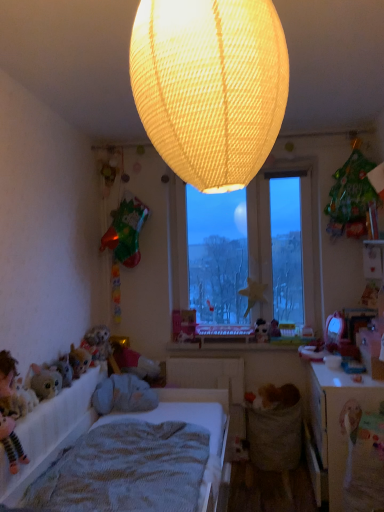
Question: Does white fabric bed at lower left have a smaller size compared to wooden table at lower right?

Choices:
 (A) no
 (B) yes

Answer: (A)

Question: Can we say white fabric bed at lower left lies outside wooden table at lower right?

Choices:
 (A) yes
 (B) no

Answer: (A)

Question: Is white fabric bed at lower left wider than wooden table at lower right?

Choices:
 (A) no
 (B) yes

Answer: (B)

Question: Does white fabric bed at lower left have a lesser width compared to wooden table at lower right?

Choices:
 (A) yes
 (B) no

Answer: (B)

Question: Is white fabric bed at lower left bigger than wooden table at lower right?

Choices:
 (A) yes
 (B) no

Answer: (A)

Question: From a real-world perspective, is green matte bag at upper right, which is counted as the first toy, starting from the front, physically located above or below gray plush toy at lower left?

Choices:
 (A) below
 (B) above

Answer: (B)

Question: In terms of height, does green matte bag at upper right, the first toy in the top-to-bottom sequence, look taller or shorter compared to gray plush toy at lower left?

Choices:
 (A) short
 (B) tall

Answer: (B)

Question: Is green matte bag at upper right, the 2th toy when ordered from back to front, situated inside gray plush toy at lower left or outside?

Choices:
 (A) outside
 (B) inside

Answer: (A)

Question: In the image, is green matte bag at upper right, the first toy in the top-to-bottom sequence, on the left side or the right side of gray plush toy at lower left?

Choices:
 (A) left
 (B) right

Answer: (B)

Question: Based on their sizes in the image, would you say fluffy plush toy at lower left is bigger or smaller than matte plastic toy at center, marked as the first toy in a left-to-right arrangement?

Choices:
 (A) small
 (B) big

Answer: (B)

Question: Choose the correct answer: Is fluffy plush toy at lower left inside matte plastic toy at center, arranged as the second toy when viewed from the right, or outside it?

Choices:
 (A) inside
 (B) outside

Answer: (B)

Question: From the image's perspective, is fluffy plush toy at lower left above or below matte plastic toy at center, arranged as the first toy when viewed from the back?

Choices:
 (A) below
 (B) above

Answer: (A)

Question: Does point (1, 385) appear closer or farther from the camera than point (261, 338)?

Choices:
 (A) closer
 (B) farther

Answer: (A)

Question: Is matte yellow fabric lampshade at upper center taller or shorter than green matte bag at upper right, the 2th toy when ordered from back to front?

Choices:
 (A) short
 (B) tall

Answer: (B)

Question: Considering their positions, is matte yellow fabric lampshade at upper center located in front of or behind green matte bag at upper right, the first toy in the top-to-bottom sequence?

Choices:
 (A) front
 (B) behind

Answer: (A)